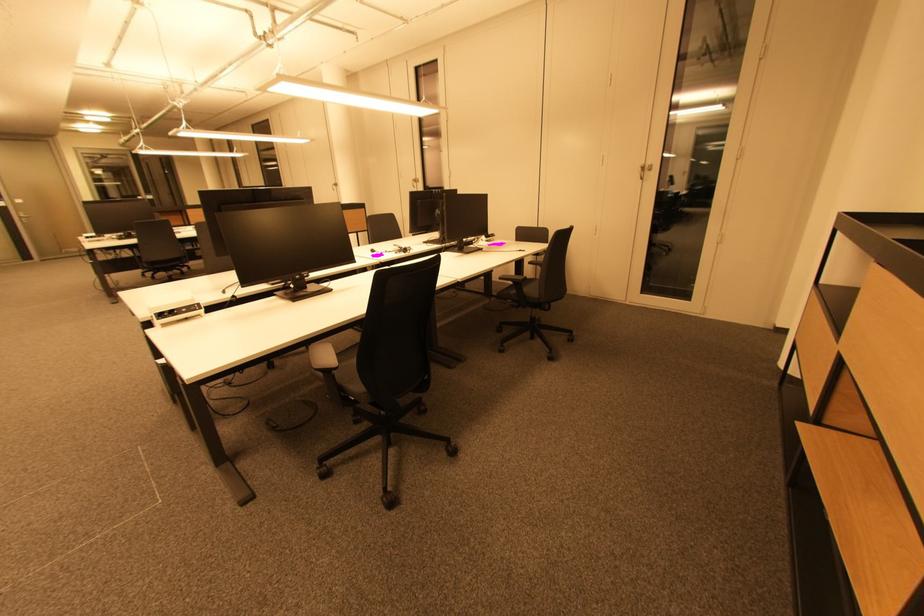
What do you see at coordinates (348, 374) in the screenshot? I see `the black chair sitting surface` at bounding box center [348, 374].